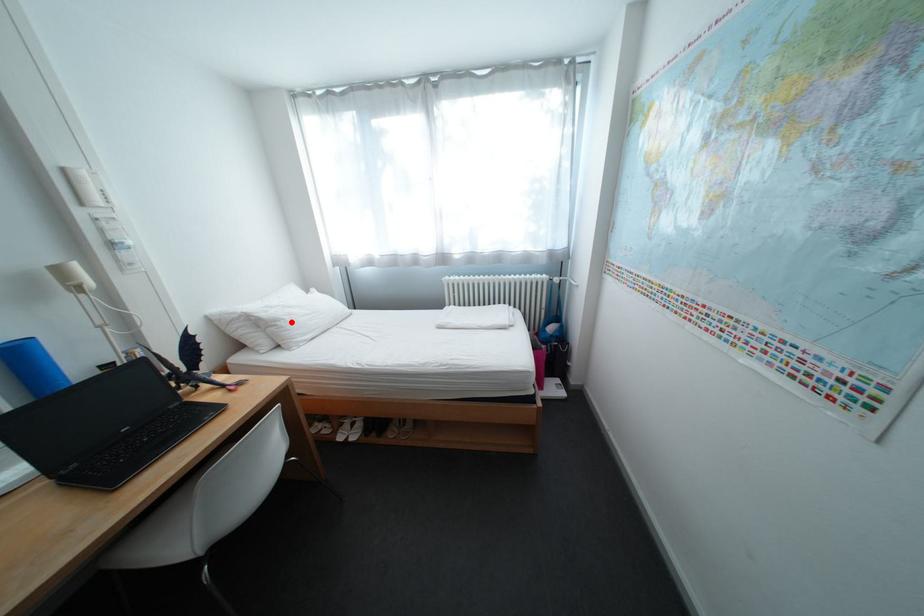
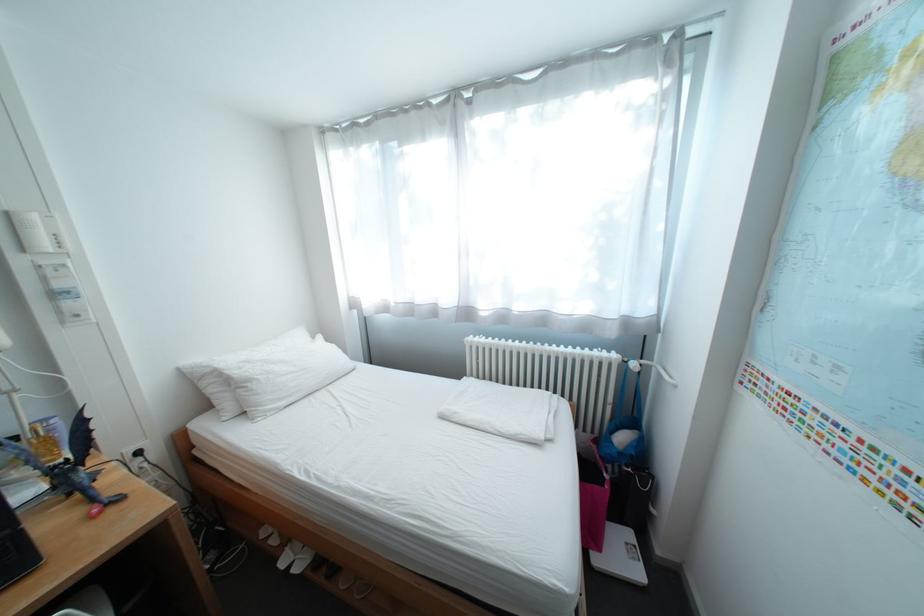
Find the pixel in the second image that matches the highlighted location in the first image.

(263, 383)